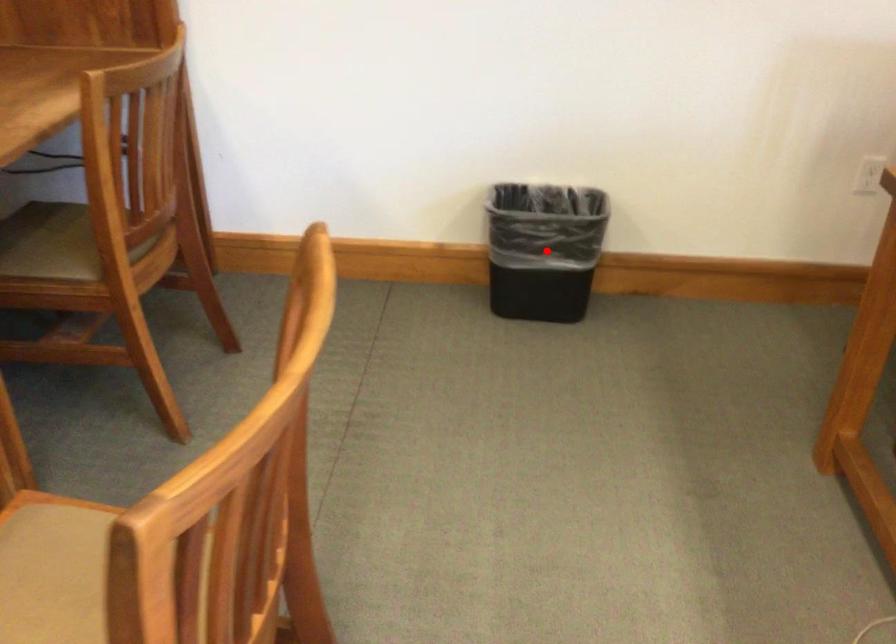
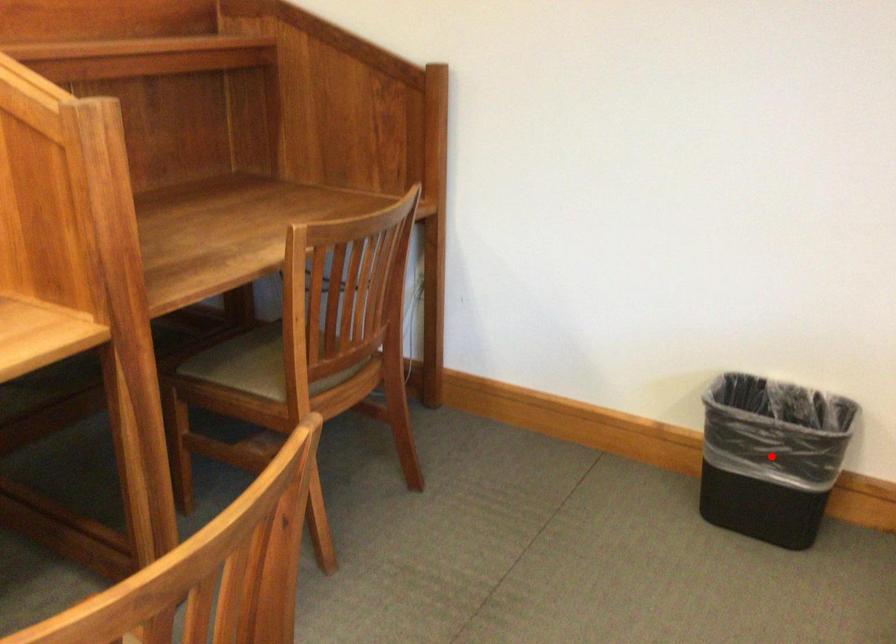
I am providing you with two images of the same scene from different viewpoints. A red point is marked on the first image and another point is marked on the second image. Is the red point in image1 aligned with the point shown in image2?

Yes